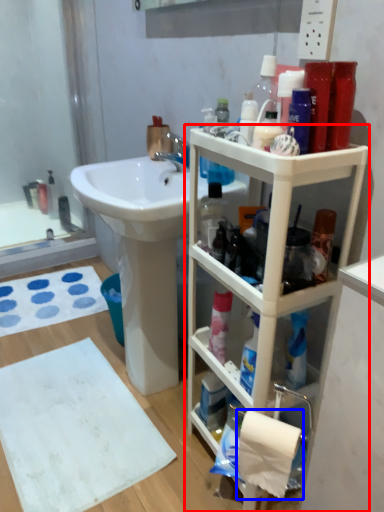
Question: Which point is further to the camera, bathroom cabinet (highlighted by a red box) or toilet paper (highlighted by a blue box)?

Choices:
 (A) bathroom cabinet
 (B) toilet paper

Answer: (B)